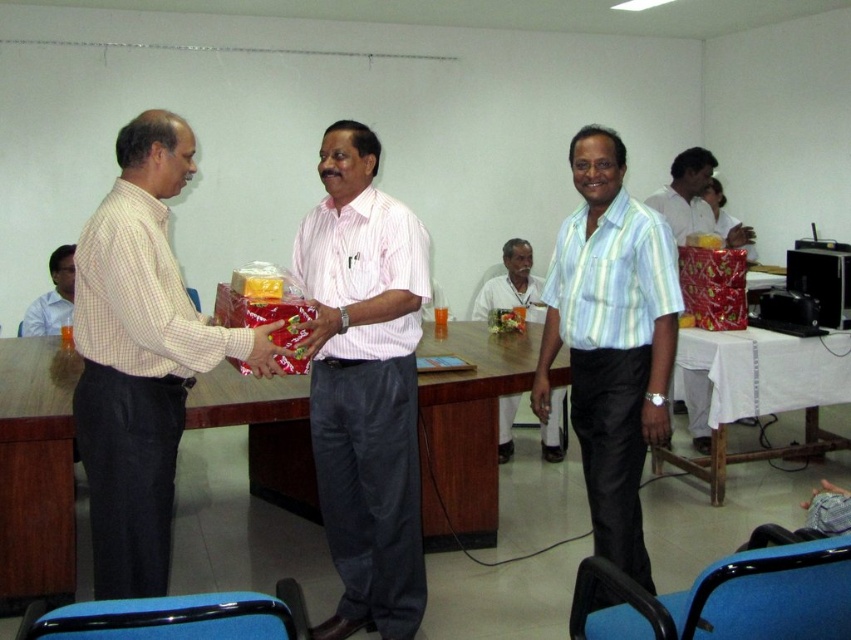
Question: Is the position of wooden table at center more distant than that of light blue striped shirt at center?

Choices:
 (A) no
 (B) yes

Answer: (B)

Question: Among these objects, which one is nearest to the camera?

Choices:
 (A) shiny metallic gift at right
 (B) matte white shirt at left
 (C) pink striped shirt at center
 (D) matte black shirt at left

Answer: (B)

Question: Estimate the real-world distances between objects in this image. Which object is closer to the shiny metallic gift at right?

Choices:
 (A) white fabric shirt at center
 (B) pink striped shirt at center
 (C) light blue striped shirt at center

Answer: (A)

Question: Which object is closer to the camera taking this photo?

Choices:
 (A) light blue striped shirt at center
 (B) matte white shirt at left
 (C) matte black shirt at left

Answer: (B)

Question: Can you confirm if wooden table at center is thinner than matte black shirt at left?

Choices:
 (A) yes
 (B) no

Answer: (B)

Question: Is shiny metallic gift at right to the right of matte black shirt at left from the viewer's perspective?

Choices:
 (A) no
 (B) yes

Answer: (B)